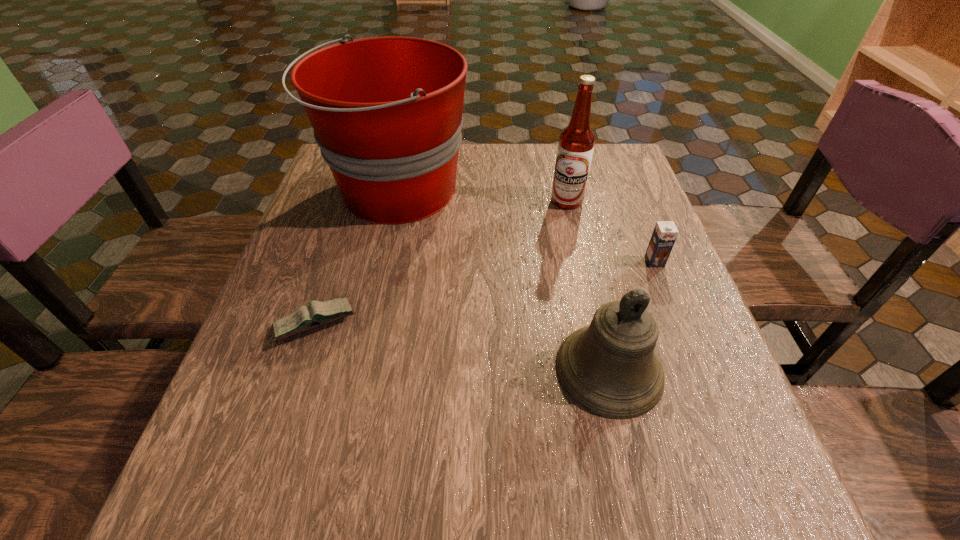
Locate an element on the screen. The height and width of the screenshot is (540, 960). free space located 0.400m on the back of the shortest object is located at coordinates (x=361, y=185).

Find the location of a particular element. This screenshot has width=960, height=540. object at the far edge is located at coordinates (387, 111).

This screenshot has width=960, height=540. I want to click on bucket that is at the left edge, so click(x=387, y=111).

Find the location of a particular element. The height and width of the screenshot is (540, 960). diary that is at the left edge is located at coordinates (304, 318).

Identify the location of alcohol located in the right edge section of the desktop. (576, 143).

Identify the location of bell that is at the right edge. (610, 367).

Identify the location of chocolate milk present at the right edge. This screenshot has height=540, width=960. (665, 233).

Locate an element on the screen. The width and height of the screenshot is (960, 540). object situated at the far left corner is located at coordinates (387, 111).

In the image, there is a desktop. Identify the location of vacant space at the far edge. This screenshot has height=540, width=960. (498, 154).

Where is `vacant position at the near edge of the desktop`? vacant position at the near edge of the desktop is located at coordinates (394, 523).